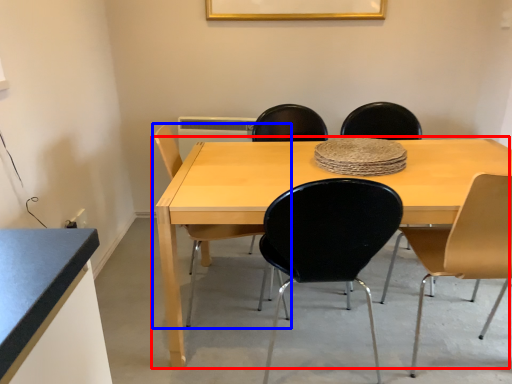
Question: Among these objects, which one is nearest to the camera, table (highlighted by a red box) or chair (highlighted by a blue box)?

Choices:
 (A) table
 (B) chair

Answer: (A)